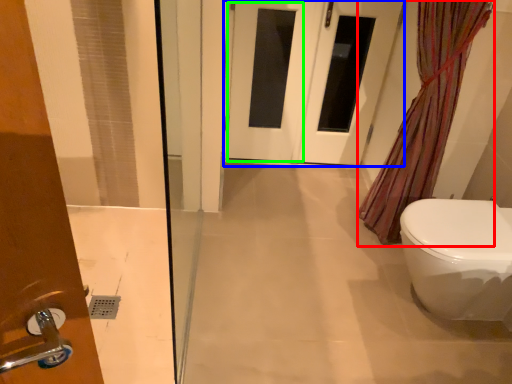
Question: Which object is positioned farthest from shower curtain (highlighted by a red box)? Select from door (highlighted by a blue box) and screen door (highlighted by a green box).

Choices:
 (A) door
 (B) screen door

Answer: (B)